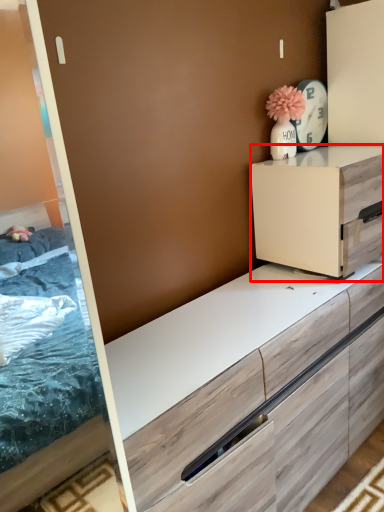
Question: Considering the relative positions of chest of drawers (annotated by the red box) and appliance in the image provided, where is chest of drawers (annotated by the red box) located with respect to the staircase?

Choices:
 (A) right
 (B) left

Answer: (A)